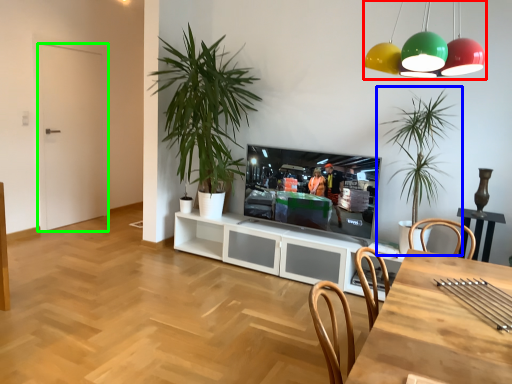
Question: Which object is the closest to the light fixture (highlighted by a red box)? Choose among these: houseplant (highlighted by a blue box) or door (highlighted by a green box).

Choices:
 (A) houseplant
 (B) door

Answer: (A)